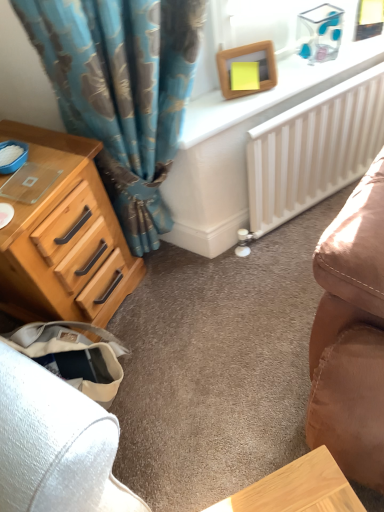
Question: In the image, is wooden picture frame at upper center on the left side or the right side of light brown wood chest of drawers at left?

Choices:
 (A) left
 (B) right

Answer: (B)

Question: Is wooden picture frame at upper center inside or outside of light brown wood chest of drawers at left?

Choices:
 (A) outside
 (B) inside

Answer: (A)

Question: Estimate the real-world distances between objects in this image. Which object is farther from the white glossy radiator at upper center?

Choices:
 (A) wooden picture frame at upper center
 (B) light brown wood chest of drawers at left
 (C) white matte radiator at center-right

Answer: (B)

Question: Considering the real-world distances, which object is farthest from the white matte radiator at center-right?

Choices:
 (A) wooden picture frame at upper center
 (B) light brown wood chest of drawers at left
 (C) white glossy radiator at upper center

Answer: (B)